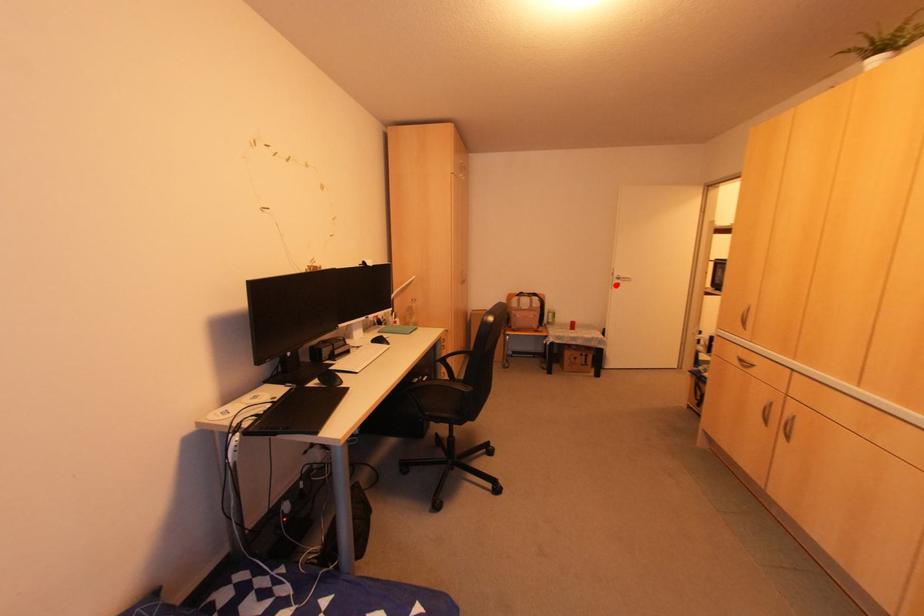
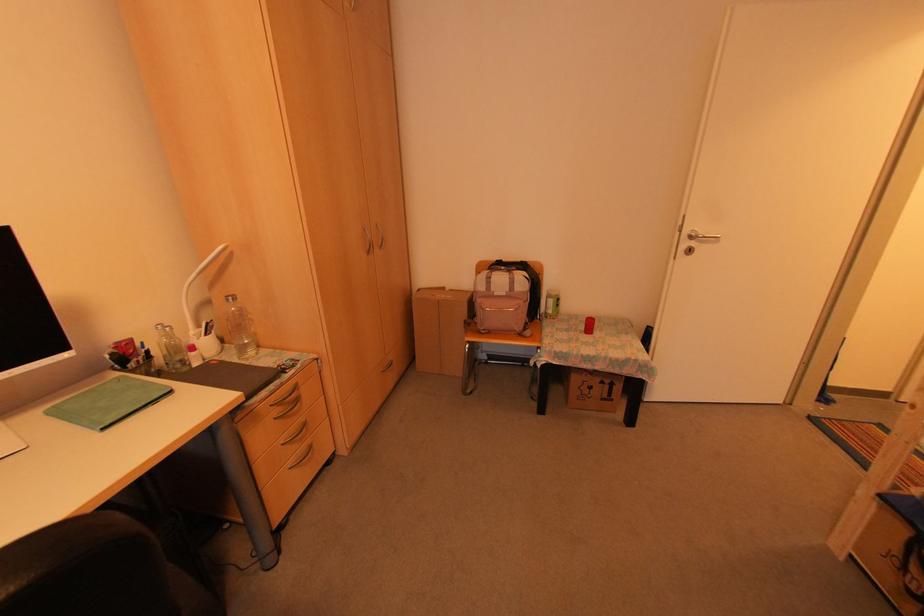
Locate, in the second image, the point that corresponds to the highlighted location in the first image.

(687, 251)